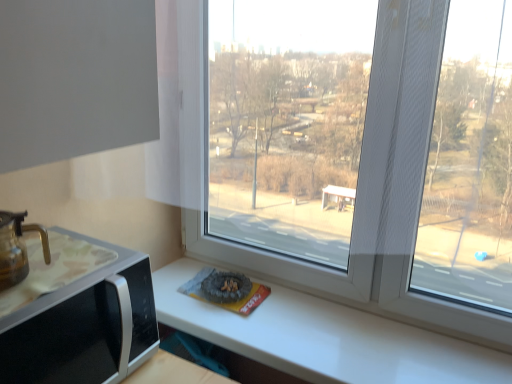
Where is `free space behind translucent glass coffeepot at lower left`? free space behind translucent glass coffeepot at lower left is located at coordinates (56, 258).